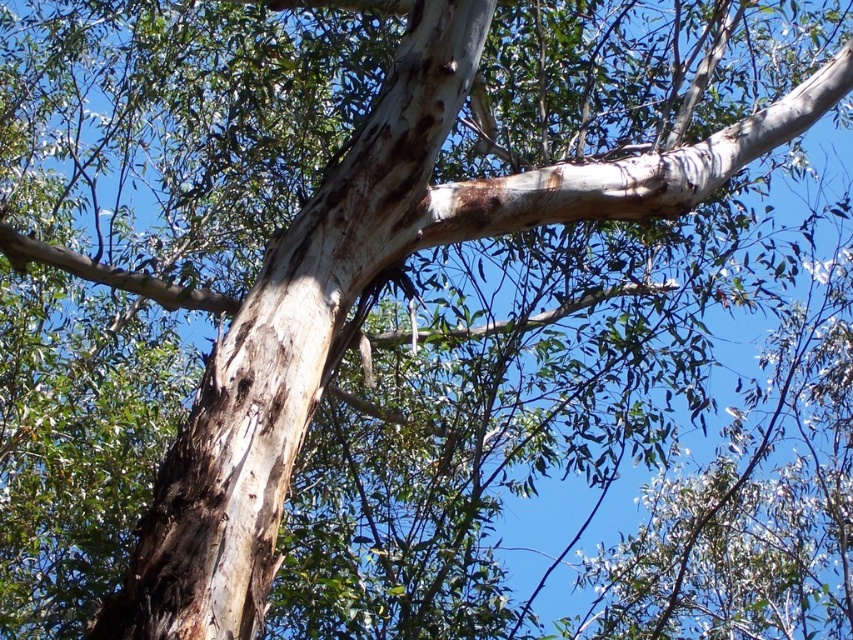
Does point (135, 600) lie behind point (843, 83)?

No.

Between point (431, 212) and point (764, 122), which one is positioned behind?

Point (764, 122)

At what (x,y) coordinates should I click in order to perform the action: click on smooth white bark at center. Please return your answer as a coordinate pair (x, y). Looking at the image, I should click on (292, 349).

Does smooth white bark at center have a greater width compared to smooth bark branch at upper center?

No, smooth white bark at center is not wider than smooth bark branch at upper center.

Is smooth white bark at center positioned before smooth bark branch at upper center?

Yes.

Is point (476, 200) farther from camera compared to point (38, 256)?

No, (476, 200) is in front of (38, 256).

Where is `smooth white bark at center`? The height and width of the screenshot is (640, 853). smooth white bark at center is located at coordinates pyautogui.click(x=292, y=349).

Is white rough bark branch at upper center positioned at the back of smooth bark branch at upper center?

No, it is not.

Consider the image. Which is more to the left, white rough bark branch at upper center or smooth bark branch at upper center?

smooth bark branch at upper center is more to the left.

Who is more distant from viewer, (631, 202) or (152, 280)?

The point (152, 280) is more distant.

Find the location of a particular element. white rough bark branch at upper center is located at coordinates (627, 173).